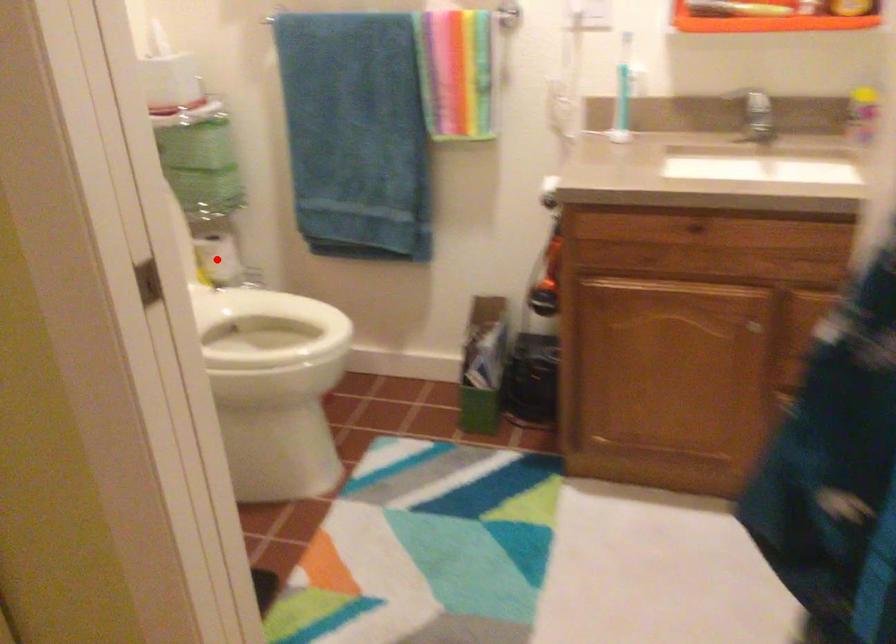
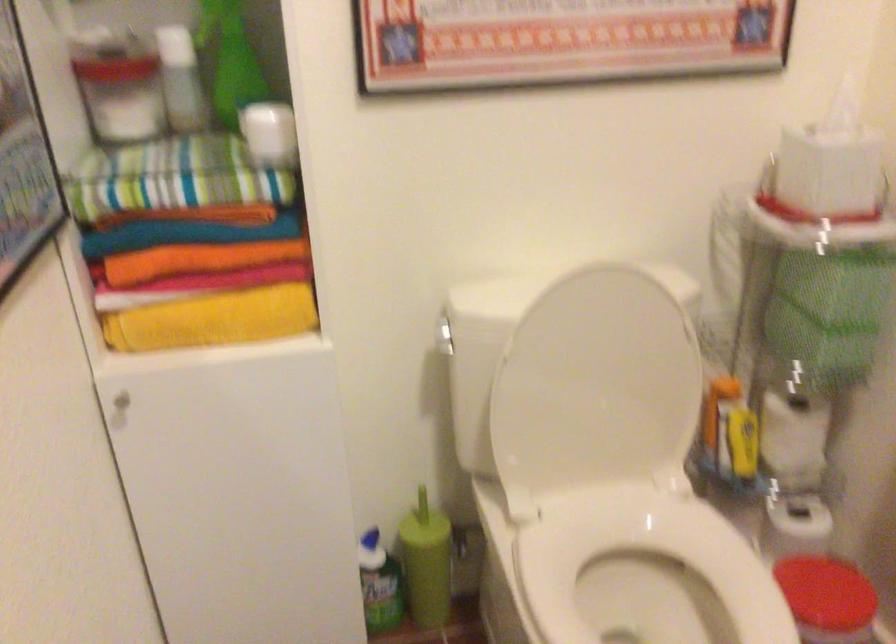
Find the pixel in the second image that matches the highlighted location in the first image.

(793, 440)